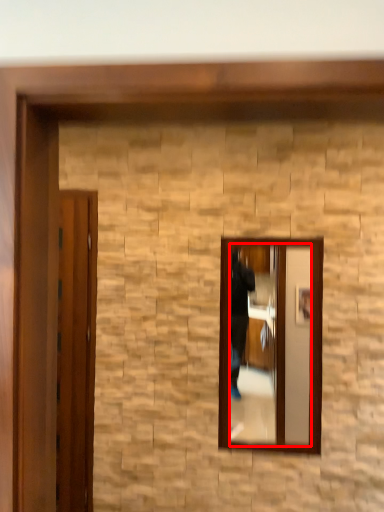
Question: From the image's perspective, where is mirror (annotated by the red box) located in relation to door in the image?

Choices:
 (A) above
 (B) below

Answer: (A)